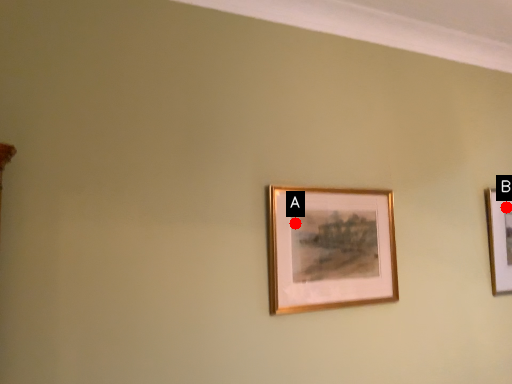
Question: Two points are circled on the image, labeled by A and B beside each circle. Which point appears farthest from the camera in this image?

Choices:
 (A) A is further
 (B) B is further

Answer: (B)